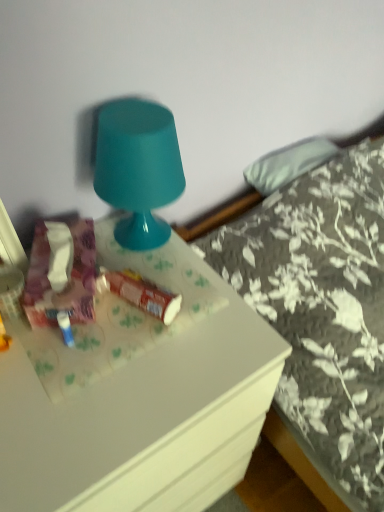
Question: From a real-world perspective, is matte floral tissue box at left, which appears as the 1th stuff when viewed from the left, below matte plastic tube at center, the second stuff when ordered from left to right?

Choices:
 (A) yes
 (B) no

Answer: (B)

Question: Is matte floral tissue box at left, which appears as the 1th stuff when viewed from the left, thinner than matte plastic tube at center, arranged as the first stuff when viewed from the right?

Choices:
 (A) no
 (B) yes

Answer: (A)

Question: Is matte floral tissue box at left, which appears as the 1th stuff when viewed from the left, positioned with its back to matte plastic tube at center, arranged as the first stuff when viewed from the right?

Choices:
 (A) yes
 (B) no

Answer: (B)

Question: Is matte floral tissue box at left, the second stuff from the right, wider than matte plastic tube at center, the second stuff when ordered from left to right?

Choices:
 (A) no
 (B) yes

Answer: (B)

Question: From a real-world perspective, does matte floral tissue box at left, which appears as the 1th stuff when viewed from the left, stand above matte plastic tube at center, the second stuff when ordered from left to right?

Choices:
 (A) yes
 (B) no

Answer: (A)

Question: Considering the relative positions of matte floral tissue box at left, which appears as the 1th stuff when viewed from the left, and matte plastic tube at center, the second stuff when ordered from left to right, in the image provided, is matte floral tissue box at left, which appears as the 1th stuff when viewed from the left, to the left of matte plastic tube at center, the second stuff when ordered from left to right, from the viewer's perspective?

Choices:
 (A) yes
 (B) no

Answer: (A)

Question: Is matte floral tissue box at left, the second stuff from the right, directly adjacent to glossy plastic lamp at upper center?

Choices:
 (A) no
 (B) yes

Answer: (A)

Question: Is matte floral tissue box at left, which appears as the 1th stuff when viewed from the left, facing towards glossy plastic lamp at upper center?

Choices:
 (A) yes
 (B) no

Answer: (B)

Question: Is matte floral tissue box at left, the second stuff from the right, facing away from glossy plastic lamp at upper center?

Choices:
 (A) yes
 (B) no

Answer: (B)

Question: Can you confirm if matte floral tissue box at left, which appears as the 1th stuff when viewed from the left, is bigger than glossy plastic lamp at upper center?

Choices:
 (A) yes
 (B) no

Answer: (B)

Question: From the image's perspective, does matte floral tissue box at left, the second stuff from the right, appear higher than glossy plastic lamp at upper center?

Choices:
 (A) yes
 (B) no

Answer: (B)

Question: Considering the relative sizes of matte floral tissue box at left, the second stuff from the right, and glossy plastic lamp at upper center in the image provided, is matte floral tissue box at left, the second stuff from the right, shorter than glossy plastic lamp at upper center?

Choices:
 (A) no
 (B) yes

Answer: (B)

Question: Can you confirm if white glossy desk at center is shorter than glossy plastic lamp at upper center?

Choices:
 (A) yes
 (B) no

Answer: (B)